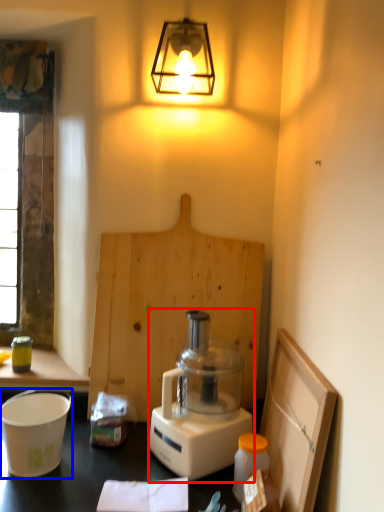
Question: Among these objects, which one is farthest to the camera, blender (highlighted by a red box) or appliance (highlighted by a blue box)?

Choices:
 (A) blender
 (B) appliance

Answer: (B)